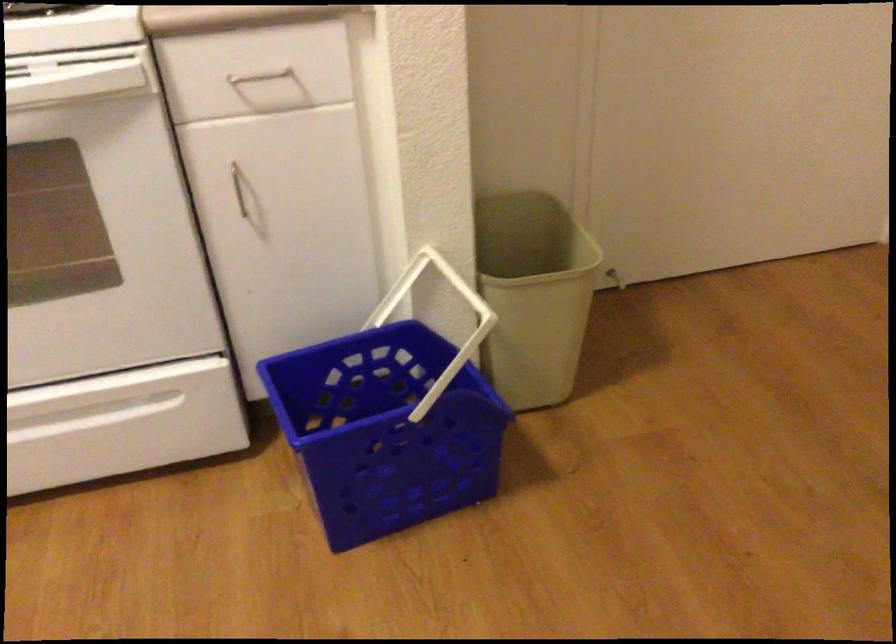
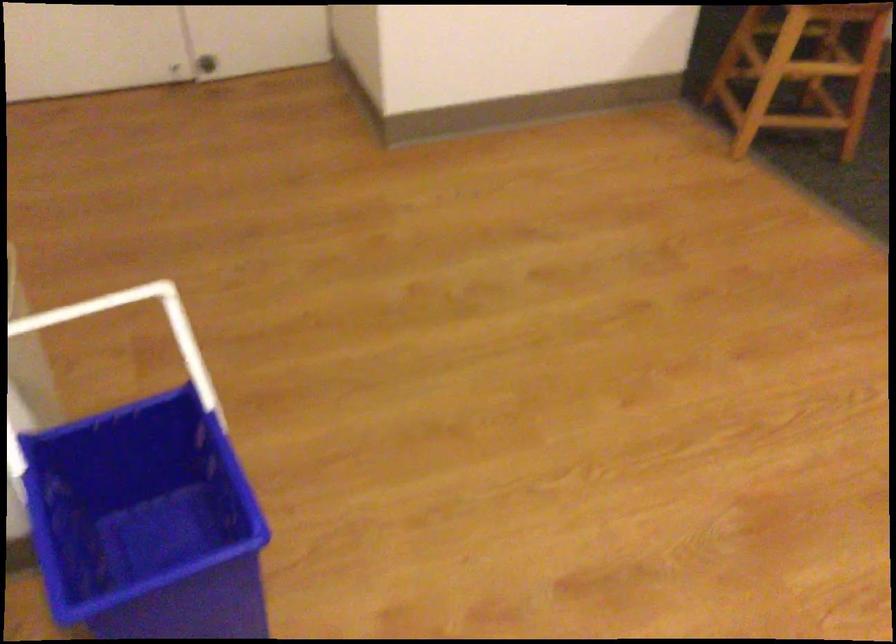
The point at (462,281) is marked in the first image. Where is the corresponding point in the second image?

(58, 316)